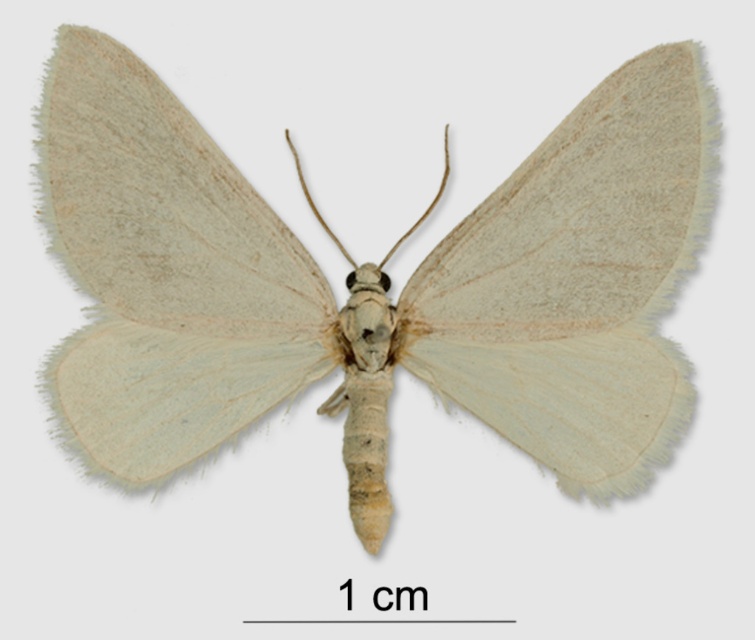
Question: In this image, where is light green fuzzy moth at center located relative to light green fringed moth wing at center?

Choices:
 (A) left
 (B) right

Answer: (B)

Question: Which of the following is the farthest from the observer?

Choices:
 (A) light green fuzzy moth at center
 (B) light green fringed moth wing at center

Answer: (A)

Question: Does light green fuzzy moth at center have a smaller size compared to light green fringed moth wing at center?

Choices:
 (A) no
 (B) yes

Answer: (A)

Question: Which point is farther from the camera taking this photo?

Choices:
 (A) (661, 84)
 (B) (85, 458)

Answer: (B)

Question: Can you confirm if light green fuzzy moth at center is positioned to the right of light green fringed moth wing at center?

Choices:
 (A) no
 (B) yes

Answer: (B)